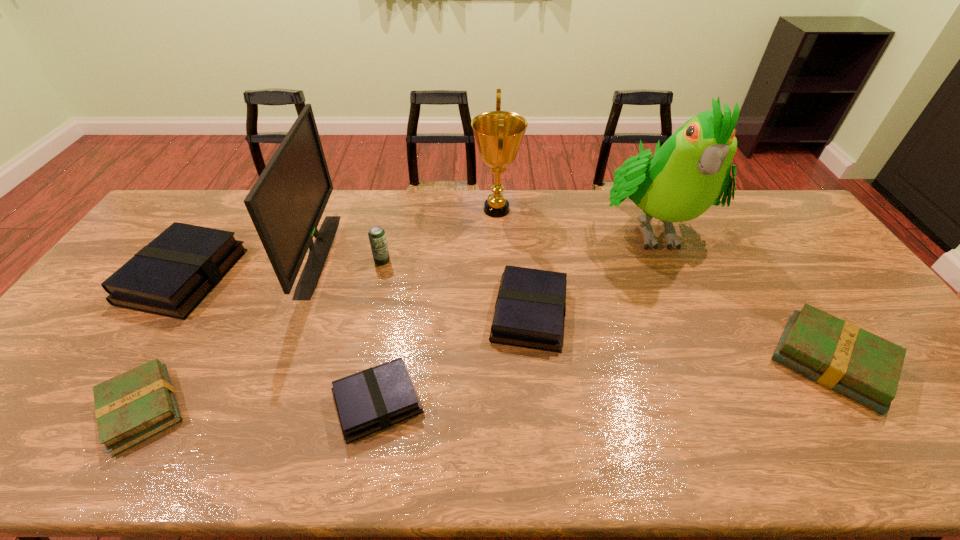
The image size is (960, 540). I want to click on free space that satisfies the following two spatial constraints: 1. on the back side of the second biggest blue book; 2. on the front view with handles of the gold award, so click(518, 210).

The width and height of the screenshot is (960, 540). Identify the location of vacant space that satisfies the following two spatial constraints: 1. on the front view with handles of the gold award; 2. on the front side of the smaller yellow book. click(x=506, y=409).

This screenshot has width=960, height=540. I want to click on vacant point that satisfies the following two spatial constraints: 1. on the front-facing side of the second book from right to left; 2. on the right side of the monitor, so click(296, 313).

At what (x,y) coordinates should I click in order to perform the action: click on free space in the image that satisfies the following two spatial constraints: 1. on the front view with handles of the gold award; 2. on the front side of the nearest blue book. Please return your answer as a coordinate pair (x, y). Looking at the image, I should click on (505, 402).

This screenshot has width=960, height=540. In order to click on free space in the image that satisfies the following two spatial constraints: 1. on the back side of the rightmost book; 2. on the front view with handles of the award in this screenshot , I will do `click(730, 210)`.

Image resolution: width=960 pixels, height=540 pixels. Identify the location of free location that satisfies the following two spatial constraints: 1. on the front view with handles of the second book from right to left; 2. on the right side of the gold award. (501, 313).